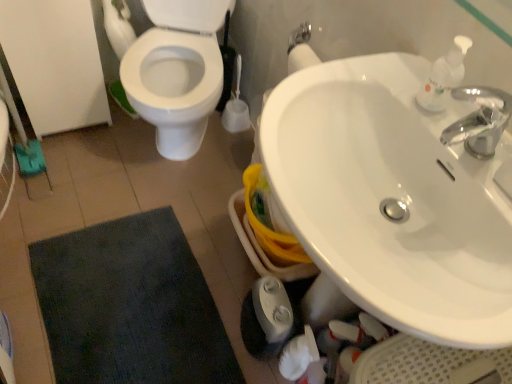
Question: Is dark blue textured bath mat at lower left inside the boundaries of white glossy sink at upper right, or outside?

Choices:
 (A) outside
 (B) inside

Answer: (A)

Question: Considering the positions of point (105, 349) and point (377, 157), is point (105, 349) closer or farther from the camera than point (377, 157)?

Choices:
 (A) farther
 (B) closer

Answer: (A)

Question: Which of these objects is positioned farthest from the dark blue textured bath mat at lower left?

Choices:
 (A) white glossy sink at upper right
 (B) white plastic soap dispenser at upper right

Answer: (B)

Question: Based on their relative distances, which object is nearer to the white glossy sink at upper right?

Choices:
 (A) white plastic soap dispenser at upper right
 (B) dark blue textured bath mat at lower left

Answer: (A)